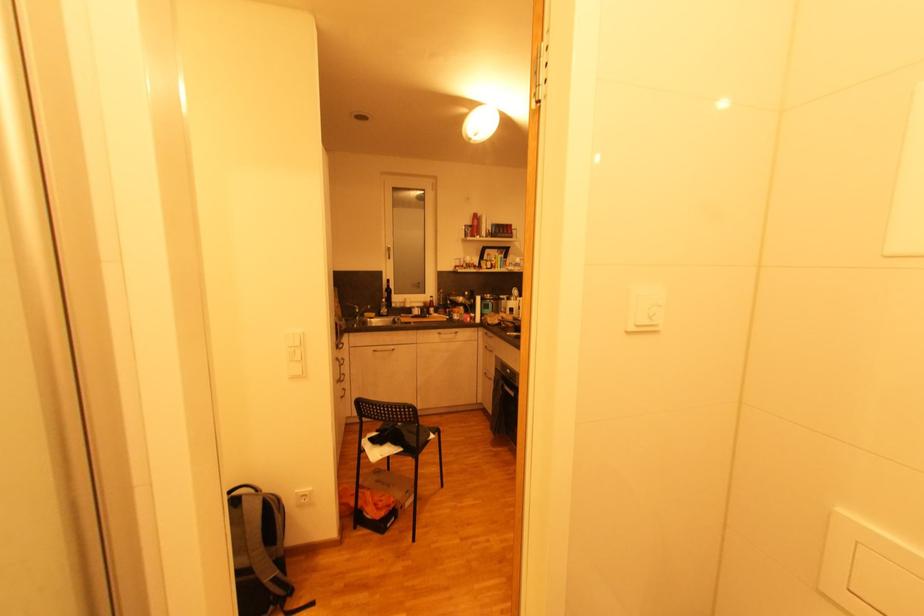
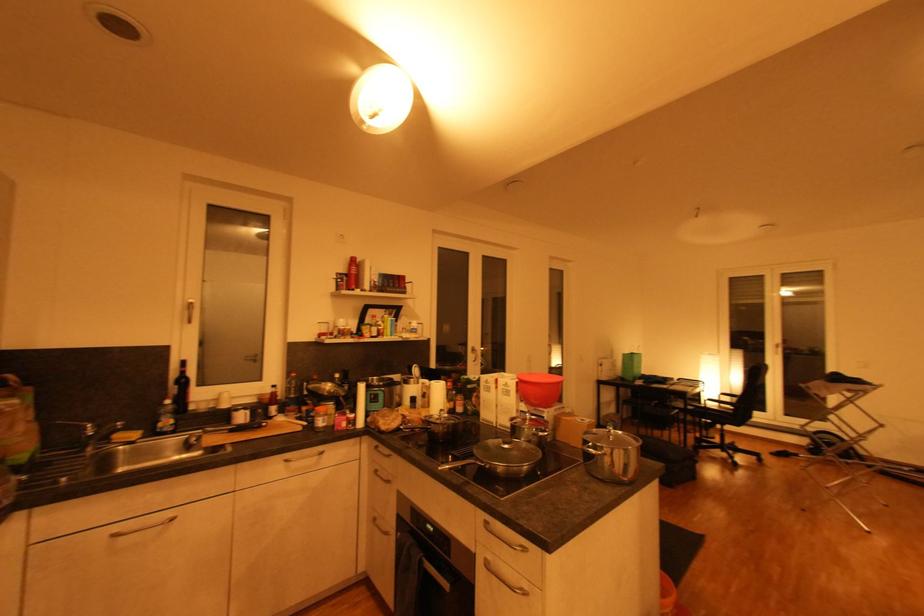
Question: Which direction would the cameraman need to move to produce the second image? Reply with the corresponding letter.

Choices:
 (A) Left
 (B) Right
 (C) Forward
 (D) Backward

Answer: (C)